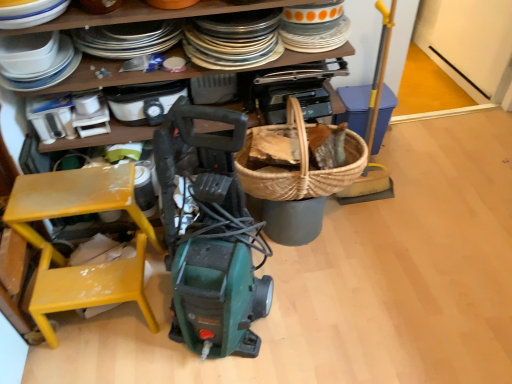
Question: From the image's perspective, is woven wood basket at center located above or below white plastic toaster at upper center, acting as the 2th appliance starting from the right?

Choices:
 (A) below
 (B) above

Answer: (A)

Question: Considering their positions, is woven wood basket at center located in front of or behind white plastic toaster at upper center, the fourth appliance positioned from the left?

Choices:
 (A) behind
 (B) front

Answer: (B)

Question: Which of these objects is positioned farthest from the white plastic container at upper left, placed as the third appliance when sorted from right to left?

Choices:
 (A) green plastic vacuum cleaner at center
 (B) white glossy plate at upper left, marked as the first appliance in a left-to-right arrangement
 (C) yellow painted wood chair at lower left
 (D) white glossy plates at upper left
 (E) white plastic toaster at upper center, the fourth appliance positioned from the left

Answer: (A)

Question: Considering the real-world distances, which object is closest to the green plastic vacuum cleaner at center?

Choices:
 (A) white glossy plate at upper left, the 5th appliance from the right
 (B) woven basket at right, which is the first appliance in right-to-left order
 (C) white glossy plates at upper left
 (D) white plastic toaster at upper center, acting as the 2th appliance starting from the right
 (E) woven wood basket at center

Answer: (E)